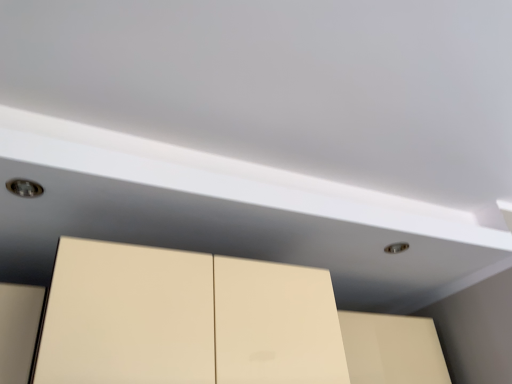
The width and height of the screenshot is (512, 384). What are the coordinates of `matte cream cabinet at center` in the screenshot? It's located at (392, 349).

The height and width of the screenshot is (384, 512). What do you see at coordinates (392, 349) in the screenshot? I see `matte cream cabinet at center` at bounding box center [392, 349].

Find the location of a particular element. This screenshot has height=384, width=512. matte cream cabinet at center is located at coordinates (392, 349).